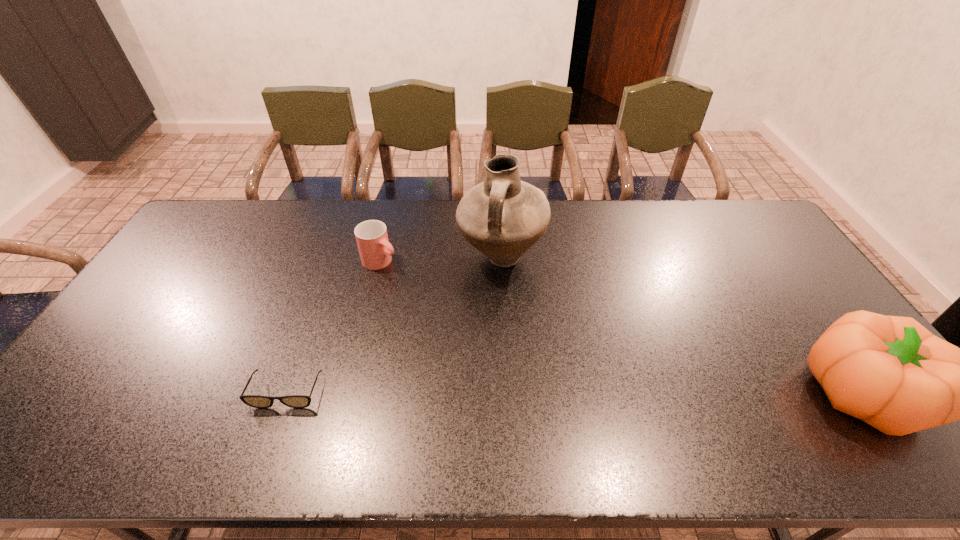
Locate an element on the screen. free point between the third object from left to right and the leftmost object is located at coordinates (394, 325).

Locate an element on the screen. This screenshot has height=540, width=960. vacant area between the second object from right to left and the leftmost object is located at coordinates (394, 325).

This screenshot has height=540, width=960. I want to click on free space between the cup and the pitcher, so click(441, 260).

Identify the location of free area in between the pitcher and the third tallest object. The height and width of the screenshot is (540, 960). (441, 260).

Identify the location of free spot between the third object from right to left and the pitcher. This screenshot has width=960, height=540. (441, 260).

The width and height of the screenshot is (960, 540). Identify the location of object that is the third nearest to the second object from left to right. pos(891,372).

Identify which object is the nearest to the rightmost object. Please provide its 2D coordinates. Your answer should be formatted as a tuple, i.e. [(x, y)], where the tuple contains the x and y coordinates of a point satisfying the conditions above.

[(502, 217)]